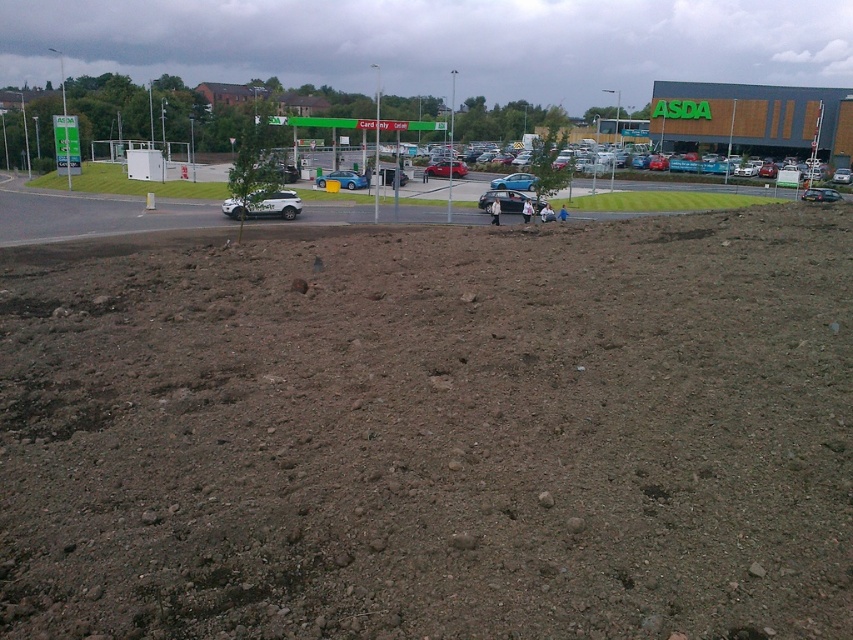
Question: Is dull brown soil at center wider than satin black car at center?

Choices:
 (A) yes
 (B) no

Answer: (A)

Question: Which point appears farthest from the camera in this image?

Choices:
 (A) (367, 182)
 (B) (541, 208)
 (C) (489, 186)
 (D) (247, 209)

Answer: (C)

Question: Which of these objects is positioned farthest from the metallic silver hatchback at center?

Choices:
 (A) metallic silver car at center
 (B) satin black car at center
 (C) white matte car at center

Answer: (C)

Question: Which point is closer to the camera?

Choices:
 (A) white matte car at center
 (B) metallic silver car at center
 (C) satin black car at center

Answer: (A)

Question: Is metallic silver car at center further to camera compared to metallic silver hatchback at center?

Choices:
 (A) no
 (B) yes

Answer: (A)

Question: Does dull brown soil at center appear under metallic silver hatchback at center?

Choices:
 (A) no
 (B) yes

Answer: (B)